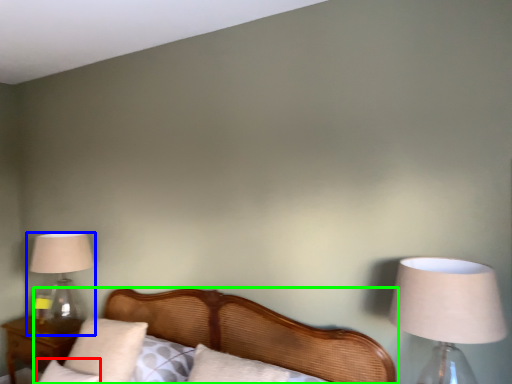
Question: Which is farther away from pillow (highlighted by a red box)? lamp (highlighted by a blue box) or bed (highlighted by a green box)?

Choices:
 (A) lamp
 (B) bed

Answer: (A)